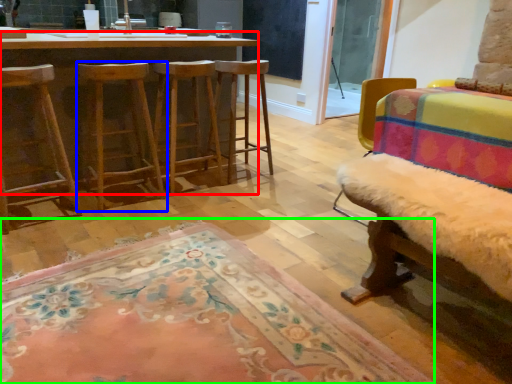
Question: Based on their relative distances, which object is nearer to desk (highlighted by a red box)? Choose from stool (highlighted by a blue box) and mat (highlighted by a green box).

Choices:
 (A) stool
 (B) mat

Answer: (A)